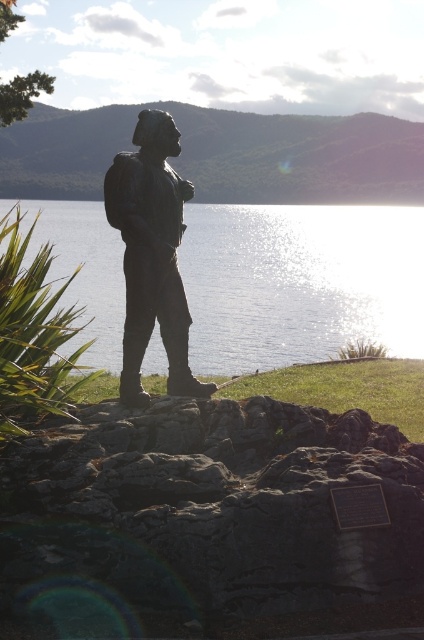
You are standing at the point marked by coordinates point (300, 282) in the scene. What do you see immediately around you?

You see glistening metallic water at center around you.

You are a tour guide explaining the statue to visitors. You want to point out the plaque near the base of the statue. Since the plaque is on the rough textured rock at center, can you confirm if the plaque is closer to the visitors than the bronze statue at center?

The rough textured rock at center is in front of the bronze statue at center, so the plaque on the rough textured rock at center is closer to the visitors than the bronze statue at center.

You are a tourist standing in front of the statue and want to take a photo of both the rough textured rock at center and the glistening metallic water at center. Which object should you focus on first to ensure both are in clear view?

You should focus on the rough textured rock at center first because it is closer to you than the glistening metallic water at center, so adjusting focus from near to far will help both be in clear view.